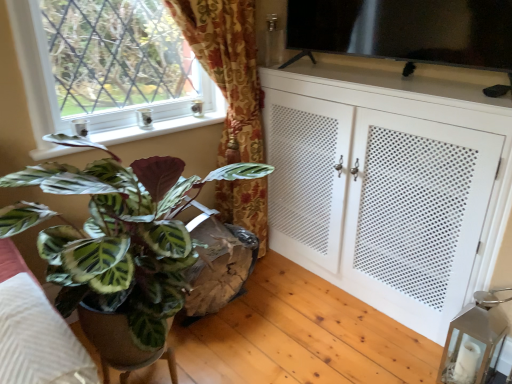
Question: Is white perforated cabinet at right at the right side of green leafy plant at lower left?

Choices:
 (A) yes
 (B) no

Answer: (A)

Question: Is white perforated cabinet at right placed right next to green leafy plant at lower left?

Choices:
 (A) yes
 (B) no

Answer: (B)

Question: From a real-world perspective, is white perforated cabinet at right over green leafy plant at lower left?

Choices:
 (A) no
 (B) yes

Answer: (A)

Question: From the image's perspective, is white perforated cabinet at right under green leafy plant at lower left?

Choices:
 (A) no
 (B) yes

Answer: (A)

Question: Is white perforated cabinet at right outside green leafy plant at lower left?

Choices:
 (A) yes
 (B) no

Answer: (A)

Question: Is white perforated cabinet at right oriented away from green leafy plant at lower left?

Choices:
 (A) no
 (B) yes

Answer: (A)

Question: Does metallic glass lantern at lower right appear on the left side of transparent glass tv at upper right?

Choices:
 (A) no
 (B) yes

Answer: (A)

Question: Considering the relative positions of metallic glass lantern at lower right and transparent glass tv at upper right in the image provided, is metallic glass lantern at lower right behind transparent glass tv at upper right?

Choices:
 (A) no
 (B) yes

Answer: (B)

Question: From a real-world perspective, is metallic glass lantern at lower right physically below transparent glass tv at upper right?

Choices:
 (A) no
 (B) yes

Answer: (B)

Question: Can you see metallic glass lantern at lower right touching transparent glass tv at upper right?

Choices:
 (A) yes
 (B) no

Answer: (B)

Question: From the image's perspective, does metallic glass lantern at lower right appear lower than transparent glass tv at upper right?

Choices:
 (A) no
 (B) yes

Answer: (B)

Question: Would you say metallic glass lantern at lower right is a long distance from transparent glass tv at upper right?

Choices:
 (A) yes
 (B) no

Answer: (A)

Question: Does white perforated cabinet at right have a greater width compared to metallic glass lantern at lower right?

Choices:
 (A) no
 (B) yes

Answer: (B)